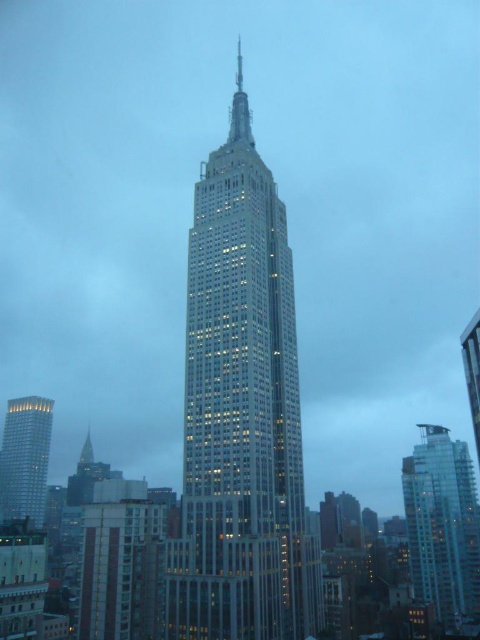
Is glassy steel skyscraper at center to the right of glassy silver skyscraper at right from the viewer's perspective?

No, glassy steel skyscraper at center is not to the right of glassy silver skyscraper at right.

Is glassy steel skyscraper at center positioned in front of glassy silver skyscraper at right?

Yes.

Locate an element on the screen. The width and height of the screenshot is (480, 640). glassy steel skyscraper at center is located at coordinates click(240, 413).

You are a GUI agent. You are given a task and a screenshot of the screen. Output one action in this format:
    pyautogui.click(x=<x>, y=<y>)
    Task: Click on the glassy steel skyscraper at center
    Image resolution: width=480 pixels, height=640 pixels.
    Given the screenshot: What is the action you would take?
    pyautogui.click(x=240, y=413)

Between glassy silver skyscraper at right and silver glass tower at lower left, which one has more height?

glassy silver skyscraper at right is taller.

Can you confirm if glassy silver skyscraper at right is positioned to the right of silver glass tower at lower left?

Indeed, glassy silver skyscraper at right is positioned on the right side of silver glass tower at lower left.

Who is more forward, [448,502] or [3,454]?

Point [448,502]

Where is `glassy silver skyscraper at right`? This screenshot has width=480, height=640. glassy silver skyscraper at right is located at coordinates (443, 524).

Can you confirm if glassy steel skyscraper at center is smaller than silver glass tower at lower left?

No.

Is point (251, 134) farther from camera compared to point (17, 515)?

No, it is in front of (17, 515).

Where is `glassy steel skyscraper at center`? The width and height of the screenshot is (480, 640). glassy steel skyscraper at center is located at coordinates (240, 413).